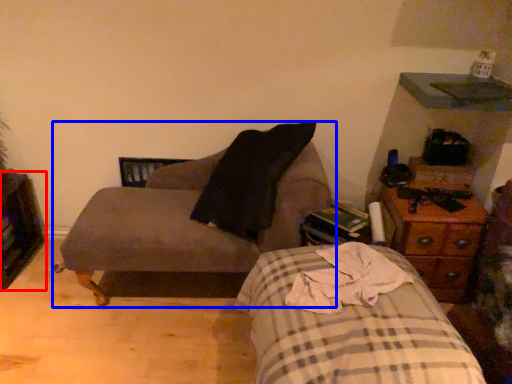
Question: Which point is closer to the camera, dresser (highlighted by a red box) or chair (highlighted by a blue box)?

Choices:
 (A) dresser
 (B) chair

Answer: (B)